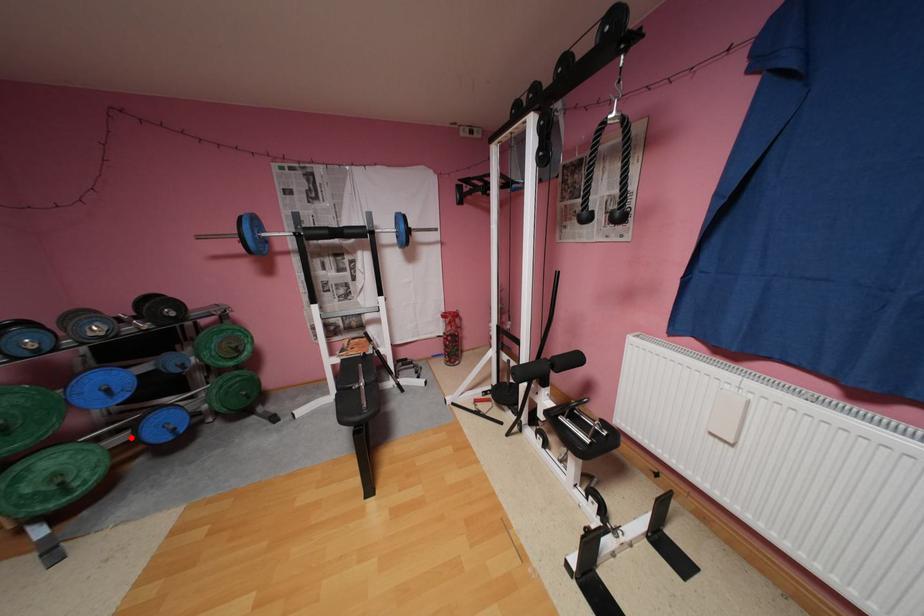
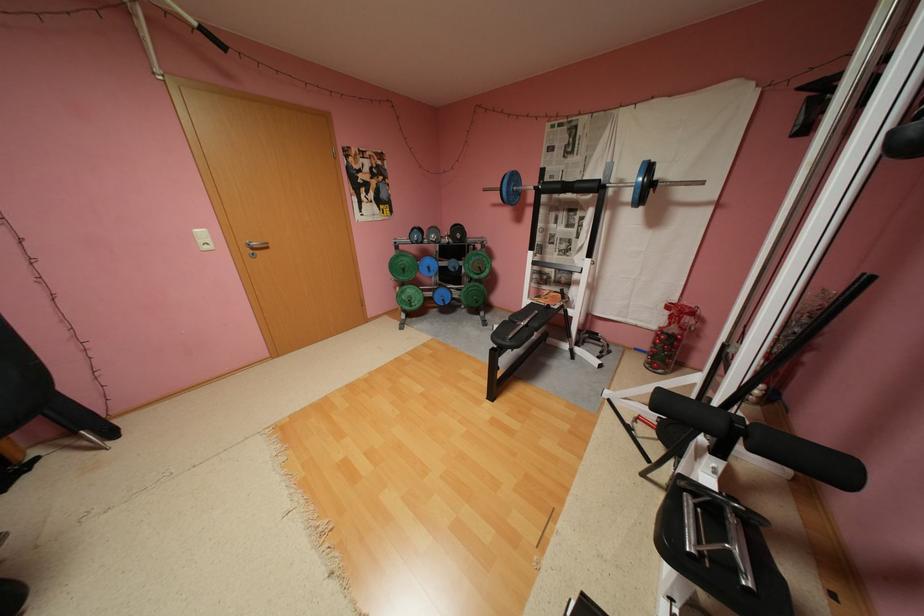
In the second image, find the point that corresponds to the highlighted location in the first image.

(439, 294)